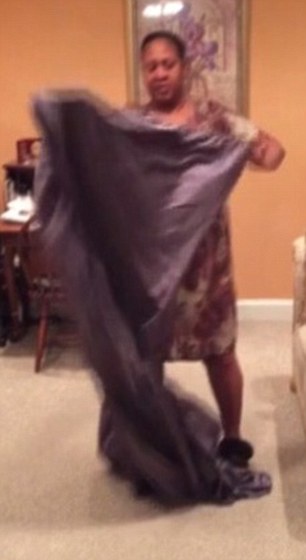
This screenshot has width=306, height=560. I want to click on white carpet, so click(x=54, y=484).